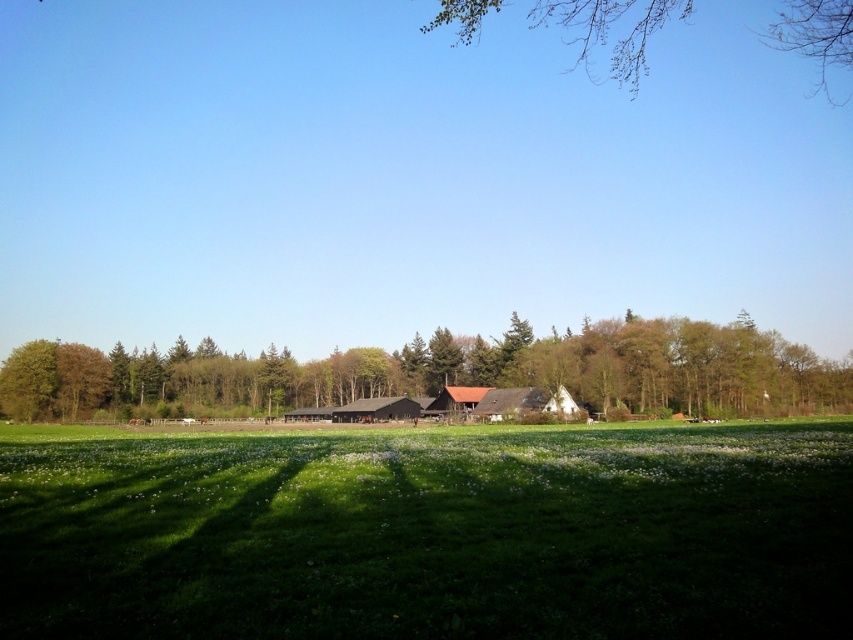
You are standing in the middle of the green grassy field at center and looking towards the bare branches at upper center. Which object is closer to your eyes?

The green grassy field at center is closer to your eyes than the bare branches at upper center because the field is at the foreground while the branches are in the mid or background as per the scene description.

What are the coordinates of the green grassy field at center?

The green grassy field at center is located at coordinates point (428, 532).